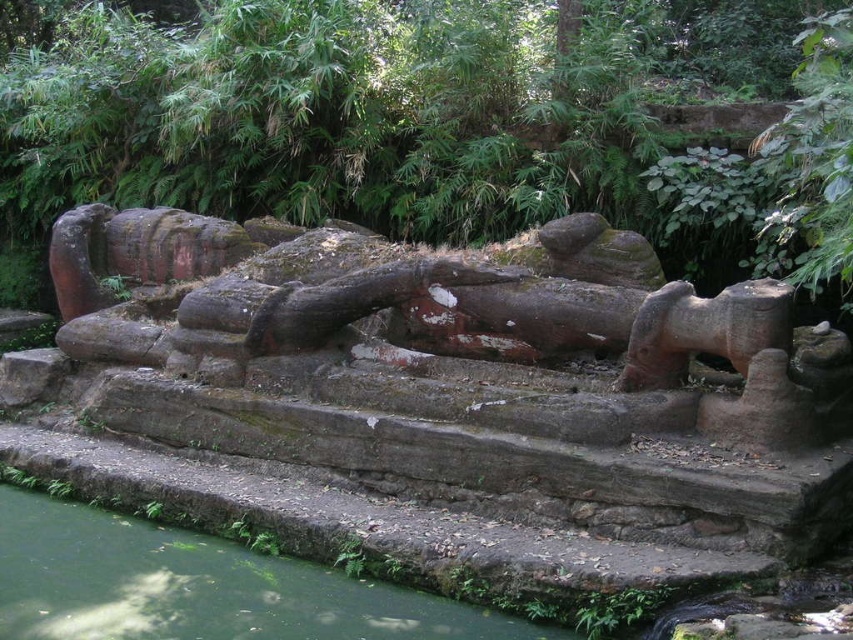
Between point (125, 26) and point (339, 600), which one is positioned behind?

The point (125, 26) is more distant.

Is point (434, 29) behind point (129, 556)?

Yes, it is behind point (129, 556).

I want to click on green mossy rock at center, so click(375, 108).